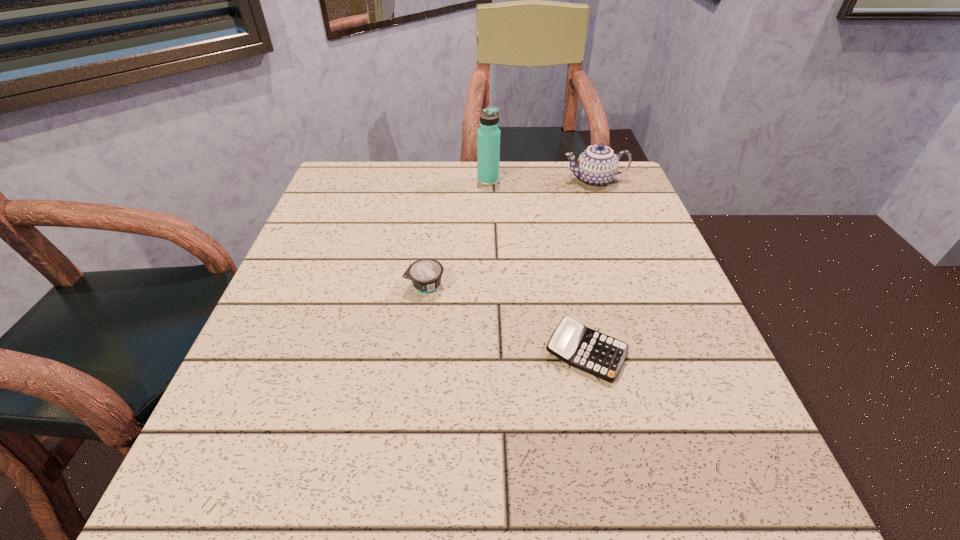
Where is `unoccupied area between the second nearest object and the calculator`? This screenshot has height=540, width=960. unoccupied area between the second nearest object and the calculator is located at coordinates (506, 319).

Locate an element on the screen. The height and width of the screenshot is (540, 960). unoccupied area between the calculator and the second shortest object is located at coordinates (506, 319).

Find the location of a particular element. Image resolution: width=960 pixels, height=540 pixels. free space between the nearest object and the second object from left to right is located at coordinates (537, 267).

At what (x,y) coordinates should I click in order to perform the action: click on free space between the second tallest object and the thermos bottle. Please return your answer as a coordinate pair (x, y). This screenshot has width=960, height=540. Looking at the image, I should click on (541, 180).

Identify the location of object identified as the closest to the second shortest object. This screenshot has width=960, height=540. (598, 354).

Identify which object is the second closest to the yogurt. Please provide its 2D coordinates. Your answer should be formatted as a tuple, i.e. [(x, y)], where the tuple contains the x and y coordinates of a point satisfying the conditions above.

[(488, 135)]

Identify the location of blank area in the image that satisfies the following two spatial constraints: 1. from the spout of the third shortest object; 2. on the front side of the calculator. (658, 353).